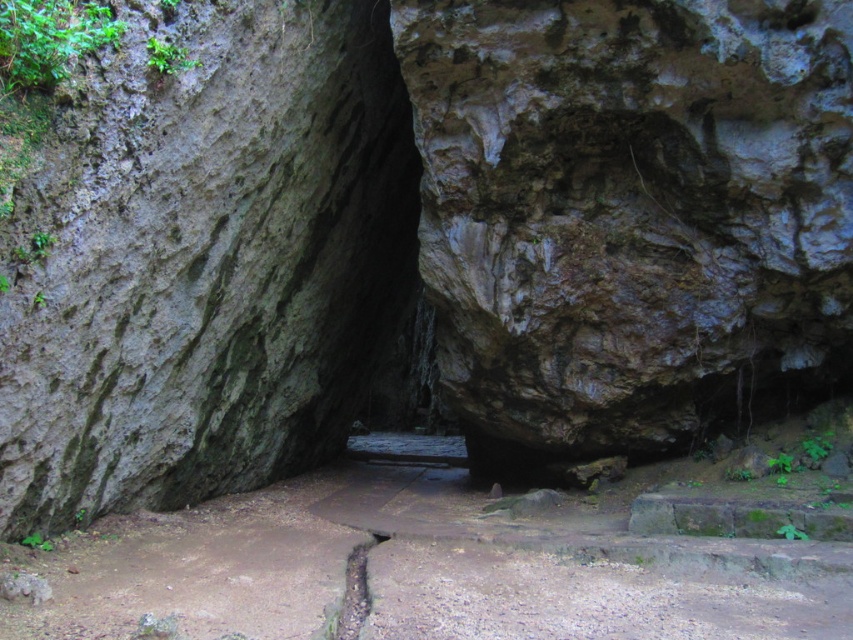
Who is positioned more to the right, brown rough rock at center or brown dirt path at center?

From the viewer's perspective, brown rough rock at center appears more on the right side.

Is brown rough rock at center shorter than brown dirt path at center?

No, brown rough rock at center is not shorter than brown dirt path at center.

Does point (595, 262) come closer to viewer compared to point (503, 573)?

No, (595, 262) is further to viewer.

The image size is (853, 640). Identify the location of brown rough rock at center. (628, 211).